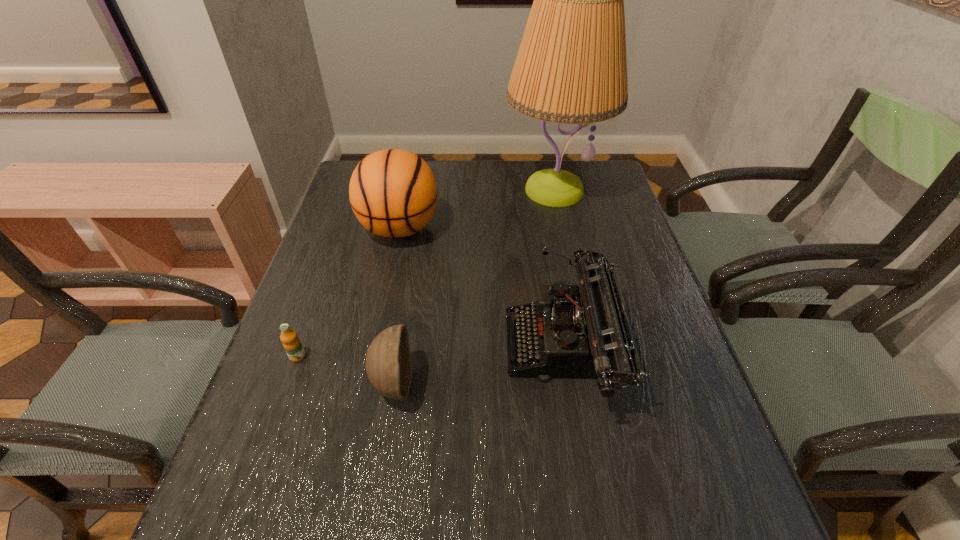
The image size is (960, 540). Identify the location of the tallest object. (571, 68).

Image resolution: width=960 pixels, height=540 pixels. In order to click on the second tallest object in this screenshot , I will do `click(393, 193)`.

Find the location of a particular element. The image size is (960, 540). typewriter is located at coordinates (586, 334).

I want to click on bowl, so click(x=389, y=368).

Locate an element on the screen. orange juice is located at coordinates (291, 342).

What are the coordinates of `the shortest object` in the screenshot? It's located at (291, 342).

Locate an element on the screen. The height and width of the screenshot is (540, 960). free region located on the side of the tallest object near the pull switch is located at coordinates (584, 328).

The width and height of the screenshot is (960, 540). Find the location of `vacant space located 0.220m on the front of the basketball`. vacant space located 0.220m on the front of the basketball is located at coordinates (380, 318).

Find the location of a particular element. free space located 0.270m on the keyboard of the typewriter is located at coordinates (382, 348).

Find the location of `vacant space located on the keyboard of the typewriter`. vacant space located on the keyboard of the typewriter is located at coordinates tap(483, 348).